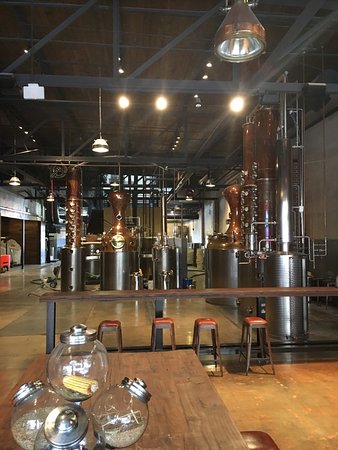
The image size is (338, 450). Identify the location of lids to the canister. (85, 337), (27, 388), (72, 417), (141, 394).